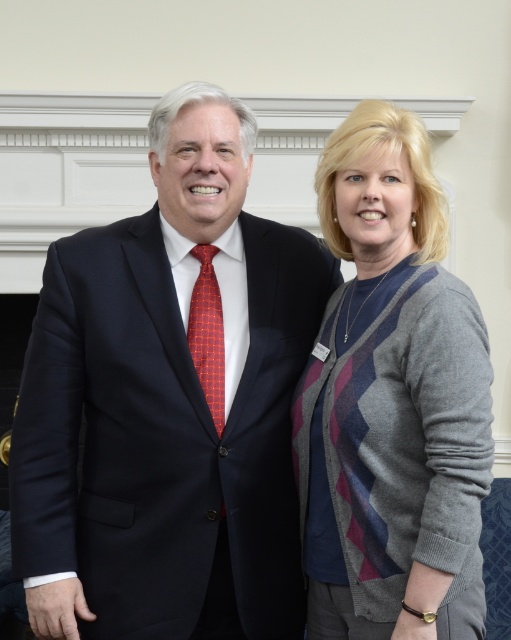
Question: Which point appears farthest from the camera in this image?

Choices:
 (A) (187, 515)
 (B) (212, 353)
 (C) (456, 321)

Answer: (B)

Question: Can you confirm if gray knit cardigan at center is bigger than red silk tie at center?

Choices:
 (A) no
 (B) yes

Answer: (B)

Question: Where is navy blue suit at left located in relation to gray knit cardigan at center in the image?

Choices:
 (A) left
 (B) right

Answer: (A)

Question: Which point appears farthest from the camera in this image?

Choices:
 (A) (447, 612)
 (B) (241, 312)

Answer: (B)

Question: Is navy blue suit at left smaller than gray knit cardigan at center?

Choices:
 (A) yes
 (B) no

Answer: (B)

Question: Estimate the real-world distances between objects in this image. Which object is farther from the red silk tie at center?

Choices:
 (A) gray knit cardigan at center
 (B) navy blue suit at left

Answer: (A)